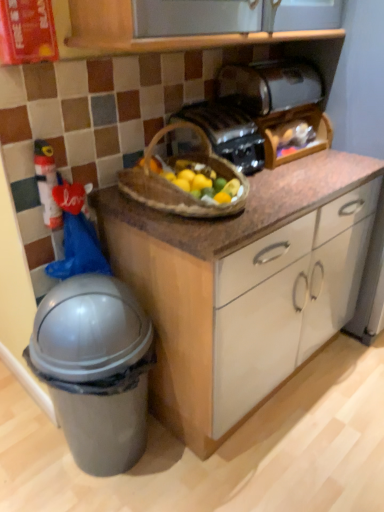
Locate an element on the screen. The height and width of the screenshot is (512, 384). vacant space to the right of gray plastic trash can at lower left is located at coordinates (202, 470).